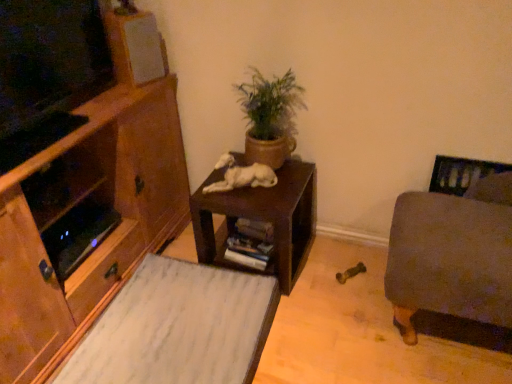
Question: From a real-world perspective, relative to velvet gray ottoman at right, is white matte speaker at upper left vertically above or below?

Choices:
 (A) below
 (B) above

Answer: (B)

Question: Is white matte speaker at upper left spatially inside velvet gray ottoman at right, or outside of it?

Choices:
 (A) inside
 (B) outside

Answer: (B)

Question: Which is farther from the white matte speaker at upper left?

Choices:
 (A) white fur dog at center
 (B) velvet gray ottoman at right
 (C) dark brown wood table at center
 (D) green matte plant pot at center
 (E) wooden drawer at lower left

Answer: (B)

Question: Which object is the farthest from the wooden drawer at lower left?

Choices:
 (A) green matte plant pot at center
 (B) wooden cabinet at left
 (C) white fur dog at center
 (D) velvet gray ottoman at right
 (E) dark brown wood table at center

Answer: (D)